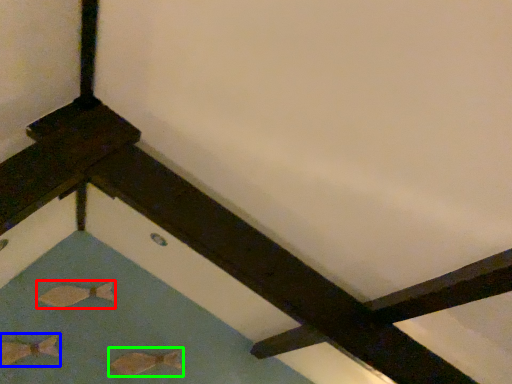
Question: Which object is positioned closest to fish (highlighted by a red box)? Select from fish (highlighted by a blue box) and fish (highlighted by a green box).

Choices:
 (A) fish
 (B) fish

Answer: (A)